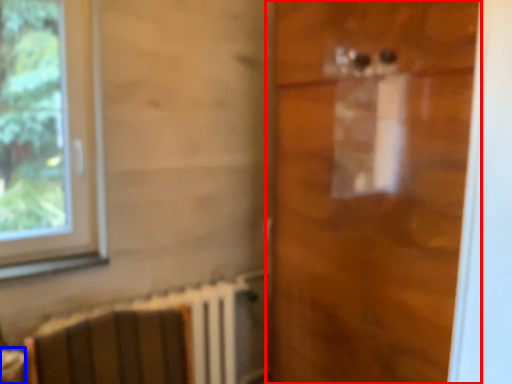
Question: Which object is closer to the camera taking this photo, door (highlighted by a red box) or table (highlighted by a blue box)?

Choices:
 (A) door
 (B) table

Answer: (A)